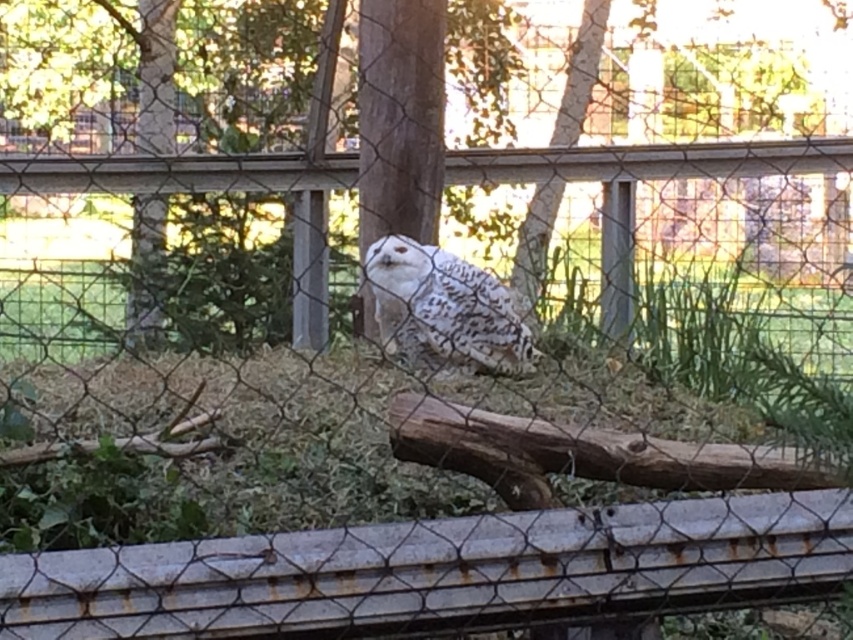
Can you confirm if rusty metal rail at lower center is positioned to the right of white speckled owl at center?

Indeed, rusty metal rail at lower center is positioned on the right side of white speckled owl at center.

This screenshot has width=853, height=640. Find the location of `rusty metal rail at lower center`. rusty metal rail at lower center is located at coordinates (439, 572).

This screenshot has width=853, height=640. Describe the element at coordinates (439, 572) in the screenshot. I see `rusty metal rail at lower center` at that location.

Where is `rusty metal rail at lower center`? This screenshot has height=640, width=853. rusty metal rail at lower center is located at coordinates (439, 572).